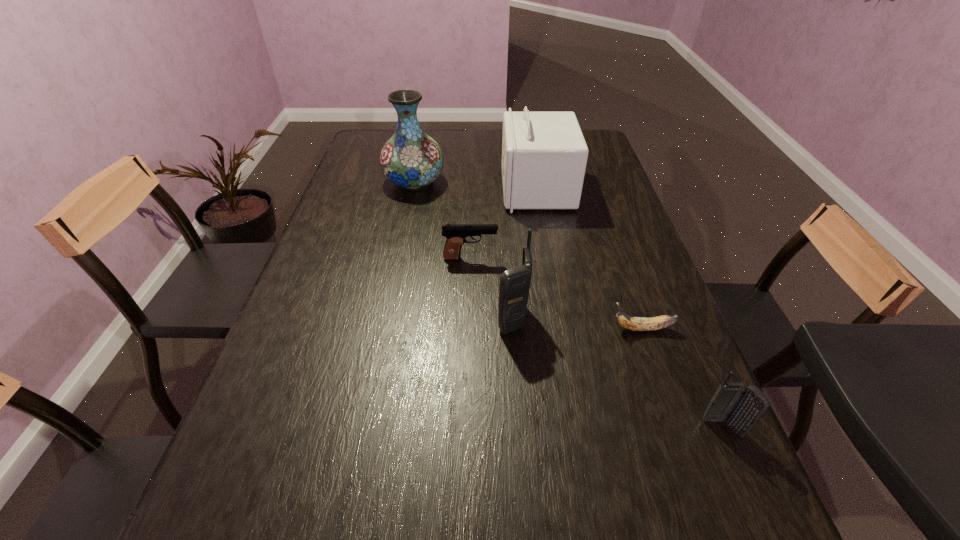
This screenshot has width=960, height=540. I want to click on free point that keeps the cellular telephones evenly spaced on the left, so click(x=370, y=245).